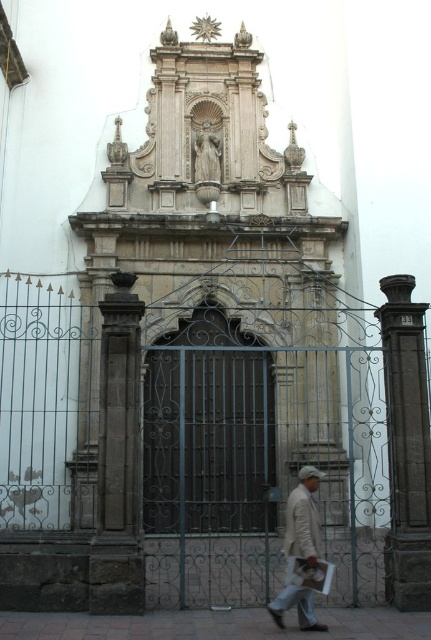
Question: Is dark wrought iron gate at center thinner than white matte jacket at lower center?

Choices:
 (A) yes
 (B) no

Answer: (B)

Question: Among these objects, which one is nearest to the camera?

Choices:
 (A) white matte jacket at lower center
 (B) dark wrought iron gate at center

Answer: (A)

Question: Is dark wrought iron gate at center thinner than white matte jacket at lower center?

Choices:
 (A) no
 (B) yes

Answer: (A)

Question: Among these points, which one is nearest to the camera?

Choices:
 (A) (168, 358)
 (B) (296, 548)

Answer: (B)

Question: Which point is farther to the camera?

Choices:
 (A) (196, 310)
 (B) (306, 483)

Answer: (A)

Question: Does dark wrought iron gate at center have a larger size compared to white matte jacket at lower center?

Choices:
 (A) no
 (B) yes

Answer: (B)